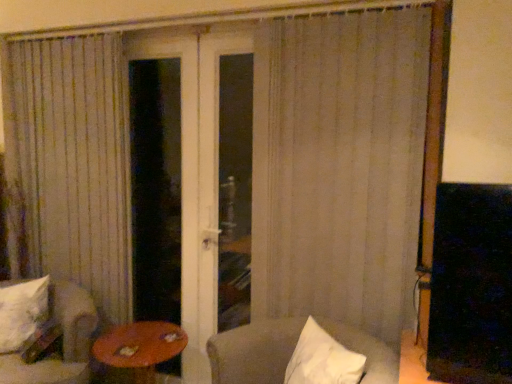
In order to face transparent glass door at center, should I rotate leftwards or rightwards?

To face it directly, rotate left by 12.968 degrees.

What is the approximate width of white textured curtain at center?

6.36 inches.

At what (x,y) coordinates should I click in order to perform the action: click on wooden round table at lower left. Please return your answer as a coordinate pair (x, y). Looking at the image, I should click on point(137,350).

Find the location of a particular element. This screenshot has width=512, height=384. transparent glass door at center is located at coordinates (192, 183).

Does point (90, 337) come behind point (261, 339)?

Yes, point (90, 337) is behind point (261, 339).

Does white fabric chair at lower left, which is the first chair from left to right, have a lesser width compared to white fabric chair at lower right, placed as the second chair when sorted from left to right?

Incorrect, the width of white fabric chair at lower left, which is the first chair from left to right, is not less than that of white fabric chair at lower right, placed as the second chair when sorted from left to right.

Measure the distance from white textured curtain at center to wooden round table at lower left.

The distance of white textured curtain at center from wooden round table at lower left is 36.61 inches.

This screenshot has height=384, width=512. What are the coordinates of `table lying behind the white textured curtain at center` in the screenshot? It's located at (137, 350).

Is white textured curtain at center in front of or behind wooden round table at lower left in the image?

white textured curtain at center is positioned closer to the viewer than wooden round table at lower left.

Can you confirm if white textured curtain at center is shorter than wooden round table at lower left?

In fact, white textured curtain at center may be taller than wooden round table at lower left.

Is white fabric chair at lower left, which is the first chair from left to right, with white soft pillow at lower left?

white fabric chair at lower left, which is the first chair from left to right, is not next to white soft pillow at lower left, and they're not touching.

Can you tell me how much white fabric chair at lower left, placed as the 2th chair when sorted from right to left, and white soft pillow at lower left differ in facing direction?

They differ by 7.26 degrees in their facing directions.

Is white fabric chair at lower left, placed as the 2th chair when sorted from right to left, bigger or smaller than white soft pillow at lower left?

Clearly, white fabric chair at lower left, placed as the 2th chair when sorted from right to left, is larger in size than white soft pillow at lower left.

In terms of width, does transparent glass door at center look wider or thinner when compared to white fabric chair at lower right, acting as the first chair starting from the right?

In the image, transparent glass door at center appears to be more narrow than white fabric chair at lower right, acting as the first chair starting from the right.

From the image's perspective, which one is positioned lower, transparent glass door at center or white fabric chair at lower right, placed as the second chair when sorted from left to right?

white fabric chair at lower right, placed as the second chair when sorted from left to right, from the image's perspective.

Is white fabric chair at lower left, which is the first chair from left to right, looking in the opposite direction of white textured curtain at center?

white fabric chair at lower left, which is the first chair from left to right, does not have its back to white textured curtain at center.

From a real-world perspective, is white fabric chair at lower left, placed as the 2th chair when sorted from right to left, below white textured curtain at center?

Yes, from a real-world perspective, white fabric chair at lower left, placed as the 2th chair when sorted from right to left, is beneath white textured curtain at center.

From the image's perspective, does white fabric chair at lower left, which is the first chair from left to right, appear lower than white textured curtain at center?

Correct, white fabric chair at lower left, which is the first chair from left to right, appears lower than white textured curtain at center in the image.

Considering their positions, is white fabric chair at lower left, which is the first chair from left to right, located in front of or behind white textured curtain at center?

white fabric chair at lower left, which is the first chair from left to right, is positioned closer to the viewer than white textured curtain at center.

Is wooden round table at lower left taller than white fabric chair at lower left, placed as the 2th chair when sorted from right to left?

No, wooden round table at lower left is not taller than white fabric chair at lower left, placed as the 2th chair when sorted from right to left.

Is wooden round table at lower left not near white fabric chair at lower left, which is the first chair from left to right?

That's not correct — wooden round table at lower left is a little close to white fabric chair at lower left, which is the first chair from left to right.

Which point is more distant from viewer, [177,340] or [69,329]?

The point [177,340] is behind.

Is wooden round table at lower left surrounding white fabric chair at lower left, which is the first chair from left to right?

No, white fabric chair at lower left, which is the first chair from left to right, is not a part of wooden round table at lower left.

Looking at this image, between white fabric chair at lower right, placed as the second chair when sorted from left to right, and white fabric chair at lower left, which is the first chair from left to right, which one has less height?

Standing shorter between the two is white fabric chair at lower right, placed as the second chair when sorted from left to right.

What's the angular difference between white fabric chair at lower right, placed as the second chair when sorted from left to right, and white fabric chair at lower left, placed as the 2th chair when sorted from right to left,'s facing directions?

80.1 degrees.

Would you say white fabric chair at lower right, acting as the first chair starting from the right, contains white fabric chair at lower left, which is the first chair from left to right?

Actually, white fabric chair at lower left, which is the first chair from left to right, is outside white fabric chair at lower right, acting as the first chair starting from the right.

In the image, is white fabric chair at lower right, placed as the second chair when sorted from left to right, on the left side or the right side of white fabric chair at lower left, placed as the 2th chair when sorted from right to left?

white fabric chair at lower right, placed as the second chair when sorted from left to right, is to the right of white fabric chair at lower left, placed as the 2th chair when sorted from right to left.

The image size is (512, 384). Identify the location of chair on the right of white fabric chair at lower left, which is the first chair from left to right. (254, 351).

Locate an element on the screen. The height and width of the screenshot is (384, 512). curtain above the wooden round table at lower left (from a real-world perspective) is located at coordinates click(x=339, y=166).

Looking at the image, which one is located further to white fabric chair at lower right, acting as the first chair starting from the right, white textured curtain at center or white fabric chair at lower left, placed as the 2th chair when sorted from right to left?

Based on the image, white fabric chair at lower left, placed as the 2th chair when sorted from right to left, appears to be further to white fabric chair at lower right, acting as the first chair starting from the right.

Based on their spatial positions, is white soft pillow at lower left or transparent glass door at center further from white textured curtain at center?

Among the two, white soft pillow at lower left is located further to white textured curtain at center.

Based on their spatial positions, is transparent glass door at center or white textured curtain at center further from wooden round table at lower left?

white textured curtain at center is positioned further to the anchor wooden round table at lower left.

Looking at the image, which one is located further to white fabric chair at lower left, placed as the 2th chair when sorted from right to left, transparent glass door at center or wooden round table at lower left?

transparent glass door at center is further to white fabric chair at lower left, placed as the 2th chair when sorted from right to left.

From the picture: Based on their spatial positions, is wooden round table at lower left or white textured curtain at center further from white soft pillow at lower left?

Based on the image, white textured curtain at center appears to be further to white soft pillow at lower left.

Considering their positions, is wooden round table at lower left positioned closer to white fabric chair at lower left, placed as the 2th chair when sorted from right to left, than transparent glass door at center?

Among the two, wooden round table at lower left is located nearer to white fabric chair at lower left, placed as the 2th chair when sorted from right to left.

Considering their positions, is transparent glass door at center positioned further to white fabric chair at lower right, acting as the first chair starting from the right, than wooden round table at lower left?

Among the two, transparent glass door at center is located further to white fabric chair at lower right, acting as the first chair starting from the right.

Estimate the real-world distances between objects in this image. Which object is further from wooden round table at lower left, white fabric chair at lower right, placed as the second chair when sorted from left to right, or transparent glass door at center?

transparent glass door at center lies further to wooden round table at lower left than the other object.

At what (x,y) coordinates should I click in order to perform the action: click on table located between white fabric chair at lower left, which is the first chair from left to right, and white fabric chair at lower right, acting as the first chair starting from the right, in the left-right direction. Please return your answer as a coordinate pair (x, y). Image resolution: width=512 pixels, height=384 pixels. Looking at the image, I should click on (137, 350).

This screenshot has height=384, width=512. What are the coordinates of `screen door located between white soft pillow at lower left and white fabric chair at lower right, acting as the first chair starting from the right, in the left-right direction` in the screenshot? It's located at (192, 183).

This screenshot has width=512, height=384. In order to click on table situated between transparent glass door at center and white textured curtain at center from left to right in this screenshot , I will do `click(137, 350)`.

Identify the location of pillow between transparent glass door at center and white fabric chair at lower left, which is the first chair from left to right, vertically. (22, 312).